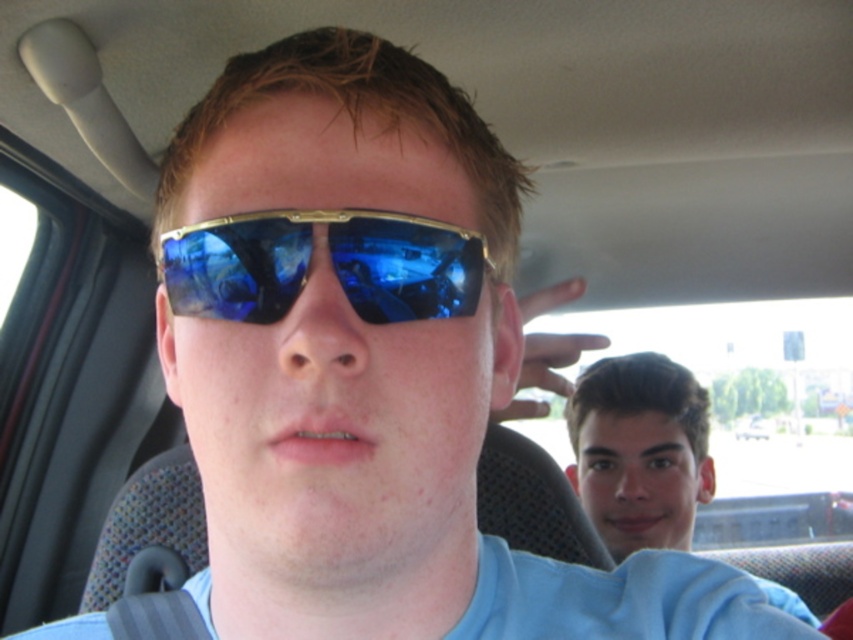
Question: Where is blue reflective lens at center located in relation to smooth skin face at right in the image?

Choices:
 (A) above
 (B) below

Answer: (A)

Question: Does blue reflective lens at center appear under smooth skin face at right?

Choices:
 (A) yes
 (B) no

Answer: (B)

Question: Does blue reflective lens at center have a smaller size compared to smooth skin face at right?

Choices:
 (A) no
 (B) yes

Answer: (B)